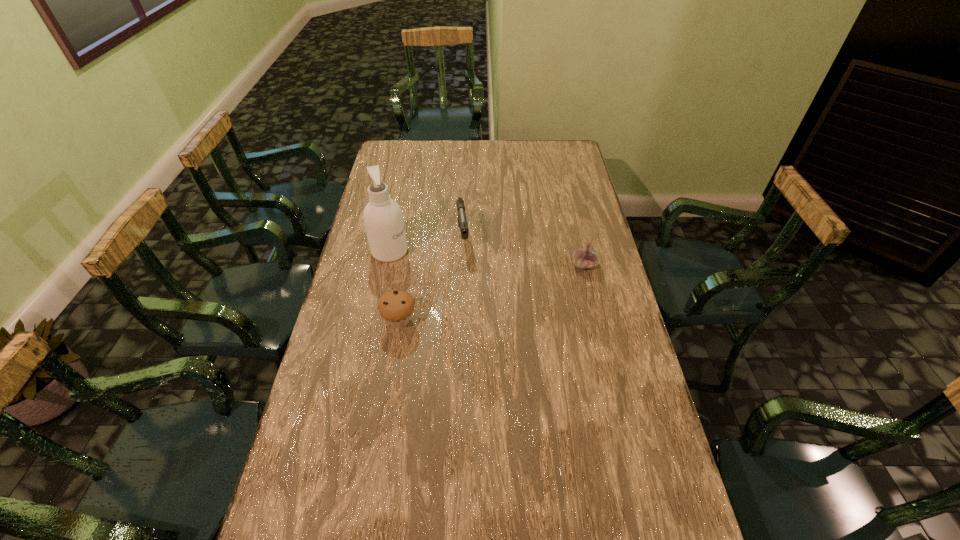
I want to click on free space between the muffin and the second object from right to left, so click(431, 278).

The height and width of the screenshot is (540, 960). I want to click on free space between the cleansing agent and the gun, so click(x=426, y=244).

This screenshot has width=960, height=540. Identify the location of vacant point located between the rightmost object and the tallest object. (487, 258).

You are a GUI agent. You are given a task and a screenshot of the screen. Output one action in this format:
    pyautogui.click(x=<x>, y=<y>)
    Task: Click on the vacant point located between the muffin and the rightmost object
    This screenshot has width=960, height=540.
    Given the screenshot: What is the action you would take?
    pyautogui.click(x=492, y=293)

Locate an element on the screen. Image resolution: width=960 pixels, height=540 pixels. empty space that is in between the nearest object and the rightmost object is located at coordinates (492, 293).

This screenshot has height=540, width=960. What are the coordinates of `free space between the cleansing agent and the nearest object` in the screenshot? It's located at (395, 286).

Locate an element on the screen. free space between the gun and the nearest object is located at coordinates (431, 278).

In order to click on vacant region between the garlic and the cleansing agent in this screenshot , I will do `click(487, 258)`.

Where is `free space between the cleansing agent and the third object from left to right`? This screenshot has width=960, height=540. free space between the cleansing agent and the third object from left to right is located at coordinates (426, 244).

The width and height of the screenshot is (960, 540). I want to click on vacant space that is in between the garlic and the third object from left to right, so click(x=524, y=251).